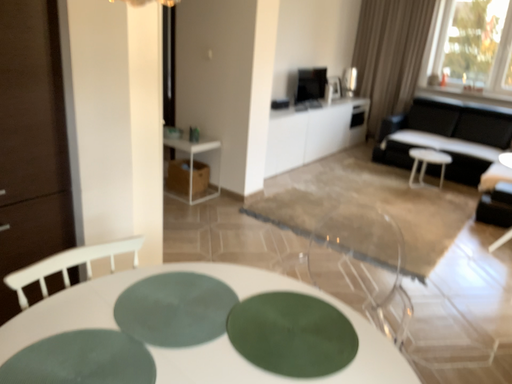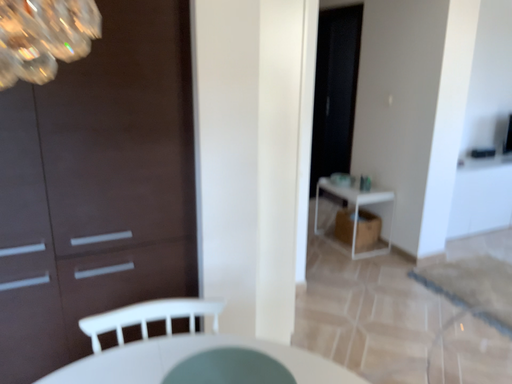
Question: Which way did the camera rotate in the video?

Choices:
 (A) rotated right
 (B) rotated left

Answer: (B)